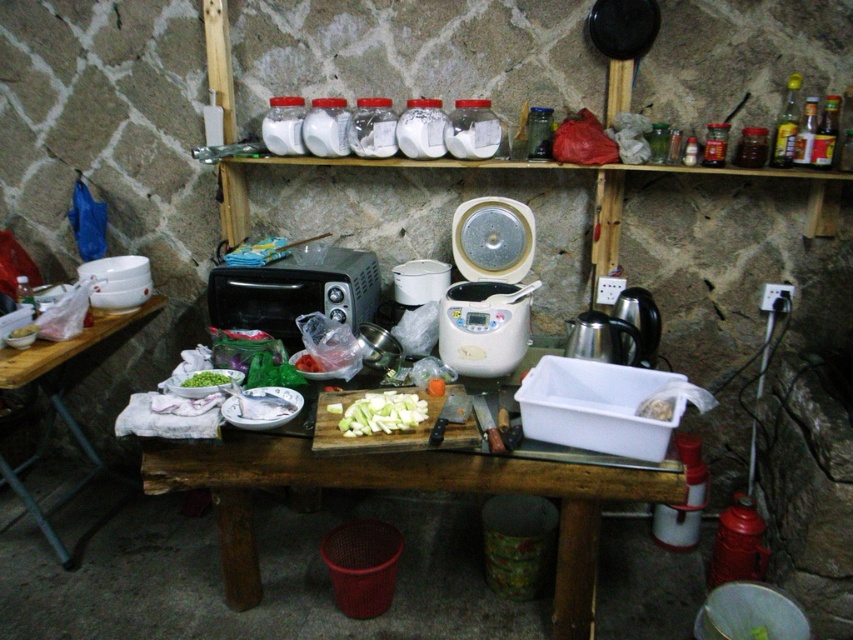
You are a chef preparing a dish and need to access both the wooden cutting board at center and the green matte sliced vegetables at center. Which object is closer to you when standing at the table?

The wooden cutting board at center is closer to you since it is in front of the green matte sliced vegetables at center.

You are preparing a meal and need to move the green matte bowl at lower left closer to the wooden cutting board at center. Which direction should you move the bowl?

You should move the green matte bowl at lower left to the right to place it closer to the wooden cutting board at center, since the wooden cutting board at center is positioned to the right of the green matte bowl at lower left.

You are standing in the rustic kitchen and need to reach both the point at coordinates (660, 490) and the point at (364, 401). Which point will you reach first?

You will reach the point at (660, 490) first because it is closer to you than the point at (364, 401).